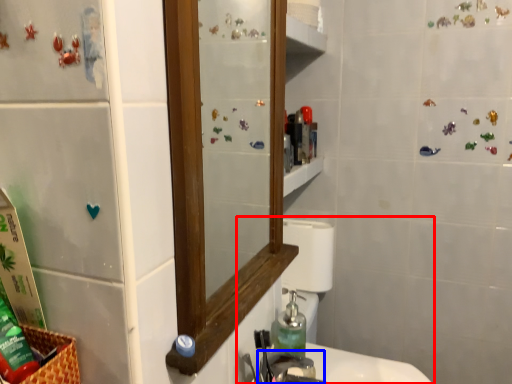
Question: Which of the following is the farthest to the observer, sink (highlighted by a red box) or faucet (highlighted by a blue box)?

Choices:
 (A) sink
 (B) faucet

Answer: (A)